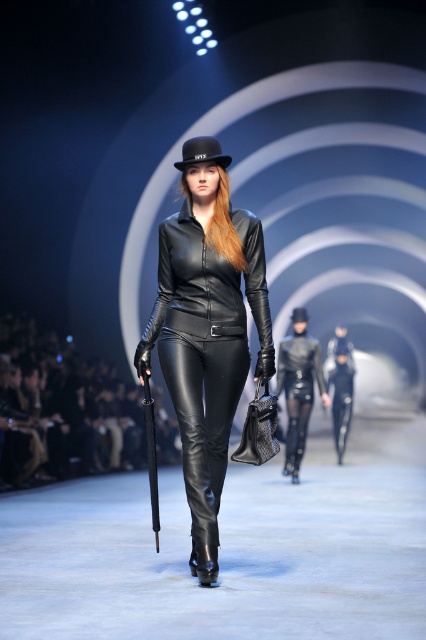
Question: Among these points, which one is farthest from the camera?

Choices:
 (A) (282, 380)
 (B) (293, 317)
 (C) (195, 144)

Answer: (A)

Question: Which object appears farthest from the camera in this image?

Choices:
 (A) black leather boot at center
 (B) black leather fedora at center
 (C) matte black leather pants at center

Answer: (C)

Question: Does matte black leather outfit at center have a lesser width compared to black leather hat at center?

Choices:
 (A) no
 (B) yes

Answer: (A)

Question: Can you confirm if matte black leather outfit at center is bigger than black leather boot at center?

Choices:
 (A) no
 (B) yes

Answer: (B)

Question: Which of the following is the closest to the observer?

Choices:
 (A) black leather hat at center
 (B) matte black leather outfit at center

Answer: (B)

Question: Is matte black leather outfit at center smaller than matte black leather pants at center?

Choices:
 (A) no
 (B) yes

Answer: (B)